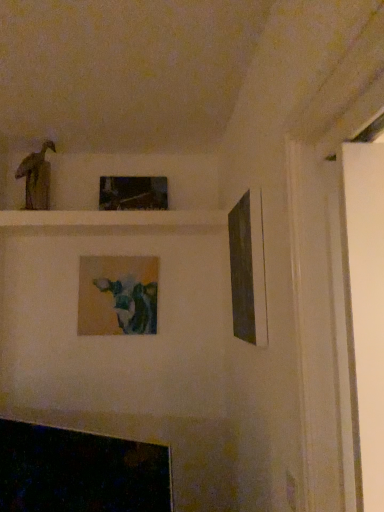
Question: Considering their positions, is matte wooden picture frame at center, which is the 2th picture frame from back to front, located in front of or behind metallic reflective frame at upper center, placed as the 2th picture frame when sorted from right to left?

Choices:
 (A) front
 (B) behind

Answer: (A)

Question: Do you think matte wooden picture frame at center, which is the 3th picture frame in right-to-left order, is within metallic reflective frame at upper center, which is the 3th picture frame in front-to-back order, or outside of it?

Choices:
 (A) outside
 (B) inside

Answer: (A)

Question: Which of these objects is positioned closest to the matte brown statue at upper left?

Choices:
 (A) matte wooden picture frame at center, which is the 2th picture frame from back to front
 (B) metallic reflective frame at upper center, placed as the 2th picture frame when sorted from right to left
 (C) matte black picture frame at right, the 3th picture frame positioned from the left

Answer: (B)

Question: Which is nearer to the metallic reflective frame at upper center, placed as the 2th picture frame when sorted from right to left?

Choices:
 (A) matte black picture frame at right, which is the first picture frame from front to back
 (B) matte brown statue at upper left
 (C) matte wooden picture frame at center, the first picture frame from the left

Answer: (B)